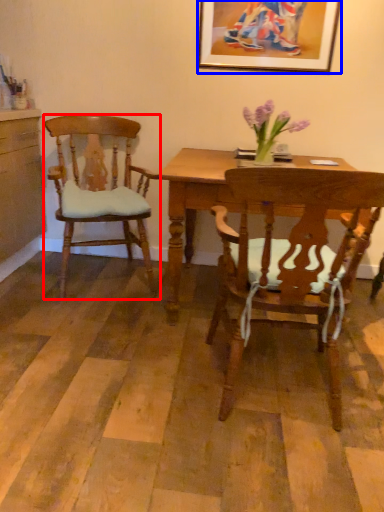
Question: Among these objects, which one is nearest to the camera, chair (highlighted by a red box) or picture frame (highlighted by a blue box)?

Choices:
 (A) chair
 (B) picture frame

Answer: (A)